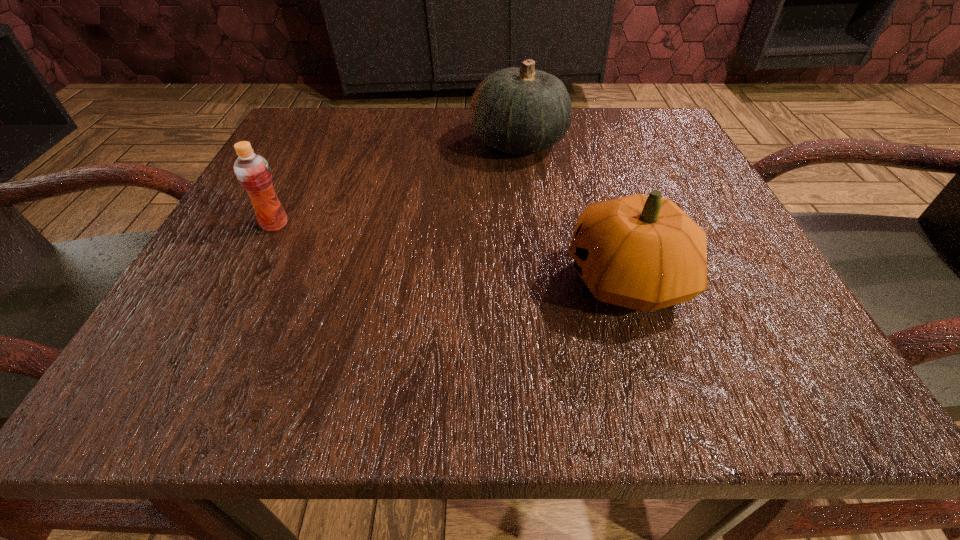
The height and width of the screenshot is (540, 960). Identify the location of free space between the nearer gourd and the second nearest object. (451, 252).

I want to click on vacant space that is in between the orange juice and the nearer gourd, so click(x=451, y=252).

At what (x,y) coordinates should I click in order to perform the action: click on free space between the farther gourd and the leftmost object. Please return your answer as a coordinate pair (x, y). The height and width of the screenshot is (540, 960). Looking at the image, I should click on (396, 184).

Where is `empty location between the nearest object and the farther gourd`? This screenshot has width=960, height=540. empty location between the nearest object and the farther gourd is located at coordinates (573, 211).

Identify the location of unoccupied position between the second nearest object and the nearer gourd. (451, 252).

Where is `free space between the farthest object and the nearer gourd`? This screenshot has height=540, width=960. free space between the farthest object and the nearer gourd is located at coordinates (573, 211).

Where is `free spot between the second farthest object and the farther gourd`? The image size is (960, 540). free spot between the second farthest object and the farther gourd is located at coordinates (396, 184).

You are a GUI agent. You are given a task and a screenshot of the screen. Output one action in this format:
    pyautogui.click(x=<x>, y=<y>)
    Task: Click on the vacant area that lies between the farthest object and the nearer gourd
    This screenshot has width=960, height=540.
    Given the screenshot: What is the action you would take?
    pyautogui.click(x=573, y=211)

Locate an element on the screen. free area in between the second farthest object and the farthest object is located at coordinates [x=396, y=184].

Identify which object is the second closest to the farther gourd. Please provide its 2D coordinates. Your answer should be formatted as a tuple, i.e. [(x, y)], where the tuple contains the x and y coordinates of a point satisfying the conditions above.

[(252, 170)]